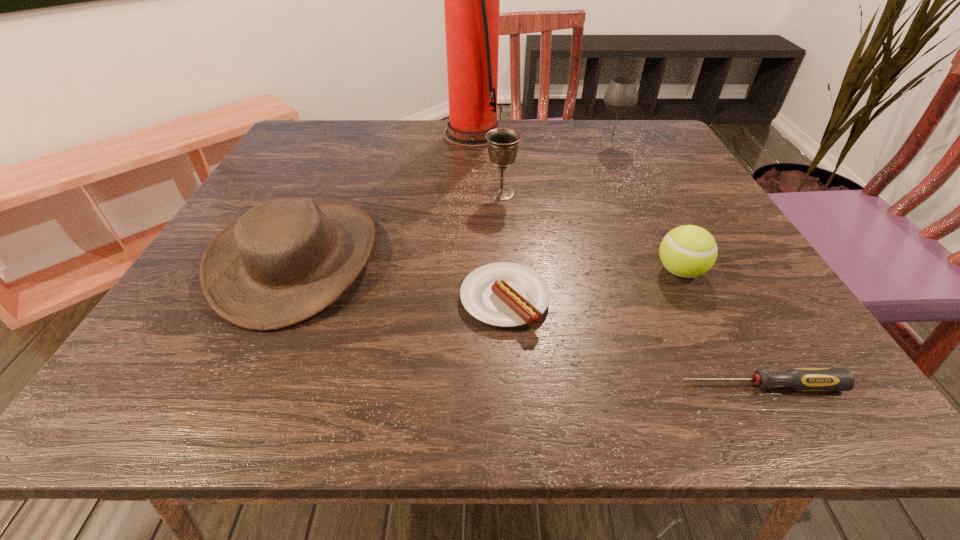
This screenshot has height=540, width=960. I want to click on object positioned at the near edge, so click(x=800, y=379).

Locate an element on the screen. object that is at the left edge is located at coordinates (284, 261).

Find the location of a particular element. The height and width of the screenshot is (540, 960). wineglass located at the right edge is located at coordinates point(621,95).

At what (x,y) coordinates should I click in order to perform the action: click on tennis ball located at the right edge. Please return your answer as a coordinate pair (x, y). Looking at the image, I should click on (687, 251).

Where is `screwdriver that is at the right edge`? screwdriver that is at the right edge is located at coordinates (800, 379).

Find the location of `object that is at the far right corner`. object that is at the far right corner is located at coordinates (621, 95).

The width and height of the screenshot is (960, 540). I want to click on object situated at the near right corner, so click(800, 379).

The height and width of the screenshot is (540, 960). In the image, there is a desktop. In order to click on vacant space at the far edge in this screenshot , I will do `click(431, 123)`.

Where is `free spot at the near edge of the desktop`? This screenshot has height=540, width=960. free spot at the near edge of the desktop is located at coordinates (469, 370).

This screenshot has height=540, width=960. Identify the location of vacant area at the right edge of the desktop. (742, 289).